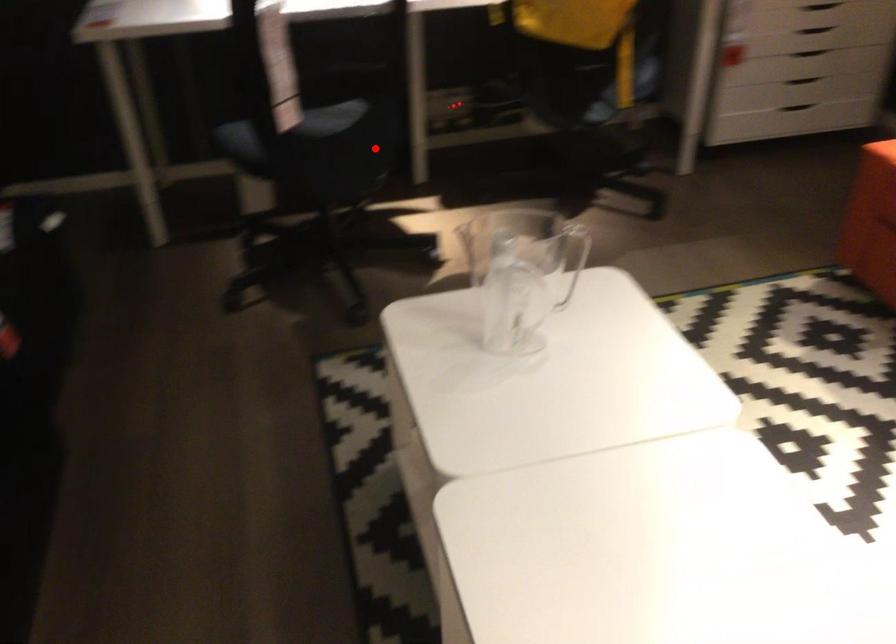
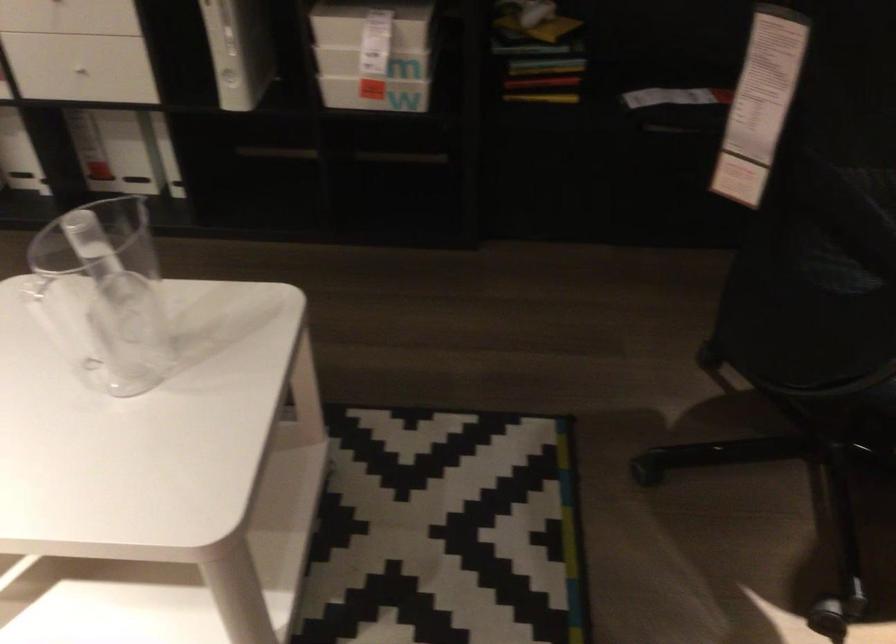
Question: I am providing you with two images of the same scene from different viewpoints. Image1 has a red point marked. In image2, the corresponding 3D location appears at what relative position? Reply with the corresponding letter.

Choices:
 (A) Closer
 (B) Farther

Answer: (A)